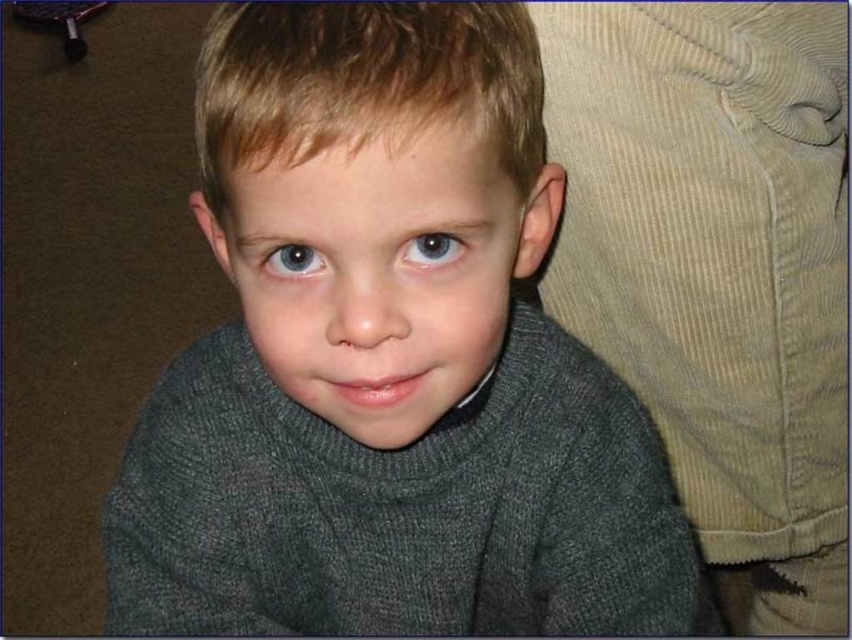
You are taking a photo of a child wearing a dark gray turtleneck sweater. You notice two points in the image labeled as point [574,90] and point [273,268]. Which point is closer to the camera?

Point [574,90] is further to the camera than point [273,268], so the point closer to the camera is point [273,268].

You are trying to decide which sweater to choose for a photoshoot. You have two options in front of you, the dark gray sweater at center and the matte gray sweater at center. Based on their sizes, which one would you pick if you want the sweater to cover more of the torso?

The dark gray sweater at center is much taller than the matte gray sweater at center, so it would cover more of the torso and be the better choice for the photoshoot.